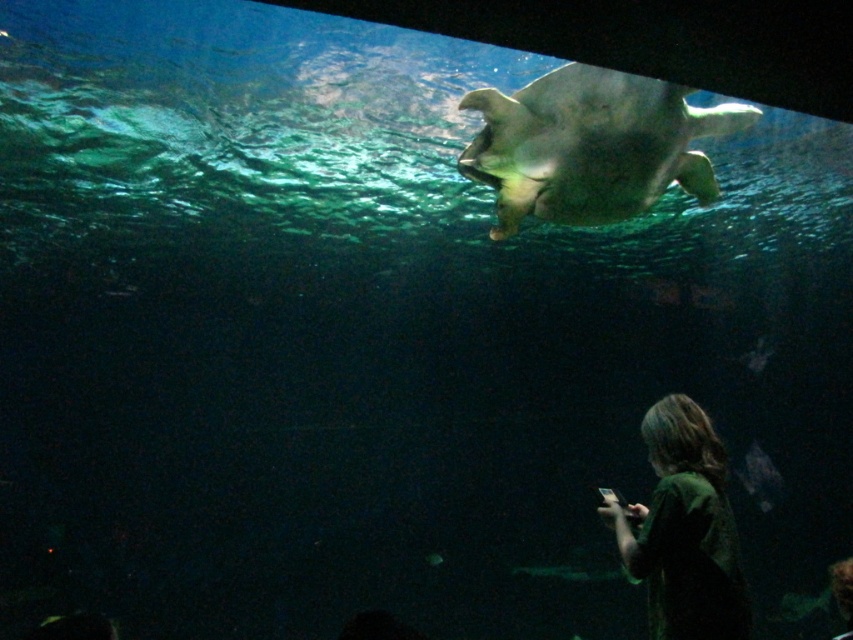
Question: Is smooth gray turtle at upper center above dark green shirt at lower right?

Choices:
 (A) no
 (B) yes

Answer: (B)

Question: Among these objects, which one is farthest from the camera?

Choices:
 (A) dark green shirt at lower right
 (B) smooth gray turtle at upper center

Answer: (B)

Question: Does smooth gray turtle at upper center have a lesser width compared to dark green shirt at lower right?

Choices:
 (A) no
 (B) yes

Answer: (A)

Question: Among these points, which one is nearest to the camera?

Choices:
 (A) (566, 84)
 (B) (722, 538)

Answer: (B)

Question: Does smooth gray turtle at upper center appear on the left side of dark green shirt at lower right?

Choices:
 (A) yes
 (B) no

Answer: (A)